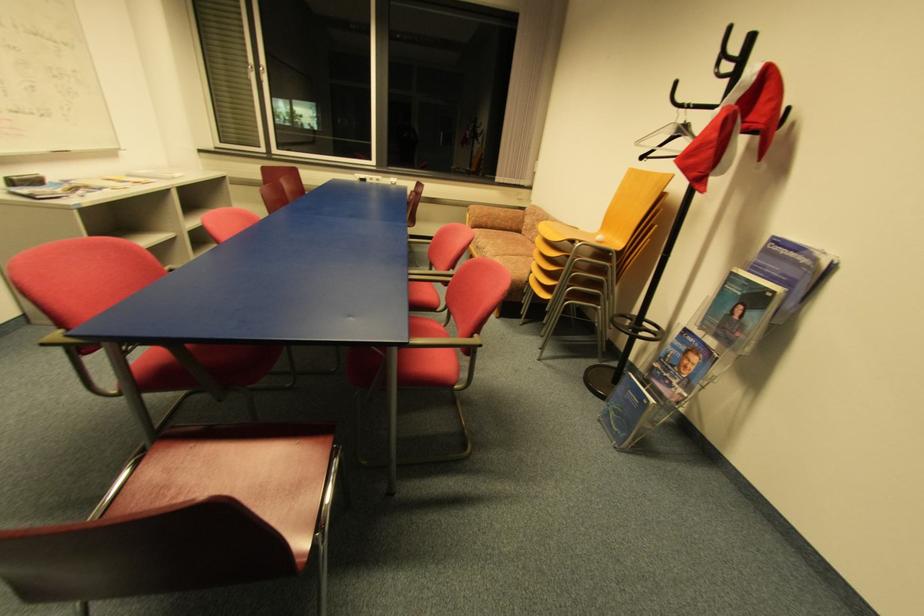
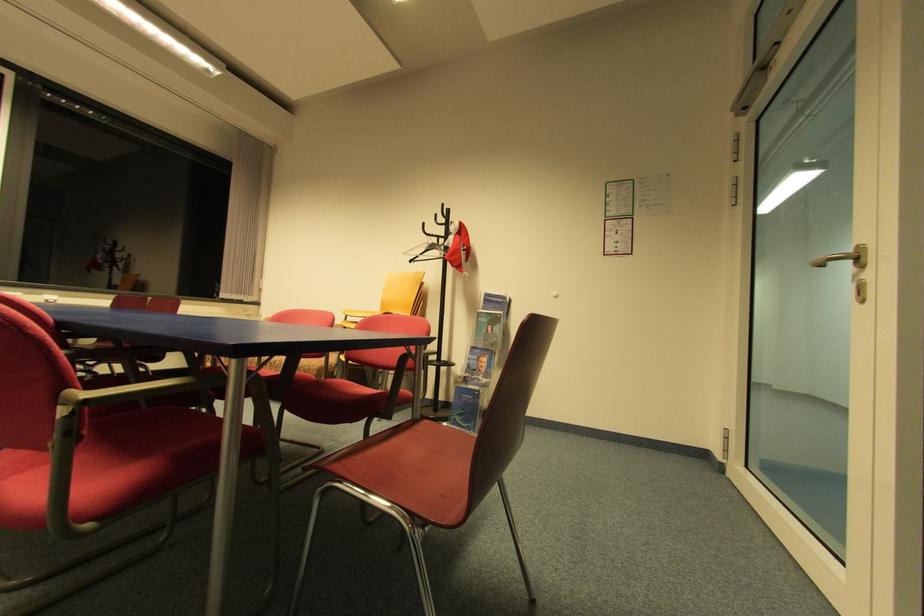
In the second image, find the point that corresponds to [621,434] in the first image.

(472, 427)